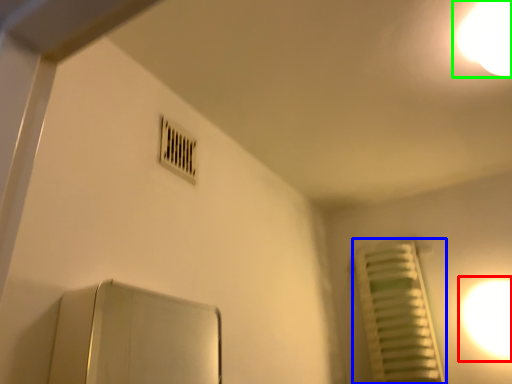
Question: Which object is the farthest from light (highlighted by a red box)? Choose among these: radiator (highlighted by a blue box) or light (highlighted by a green box).

Choices:
 (A) radiator
 (B) light

Answer: (B)